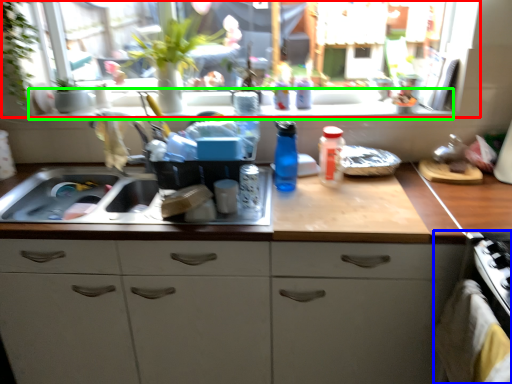
Question: Which object is positioned farthest from window (highlighted by a red box)? Select from oven (highlighted by a blue box) and window sill (highlighted by a green box).

Choices:
 (A) oven
 (B) window sill

Answer: (A)